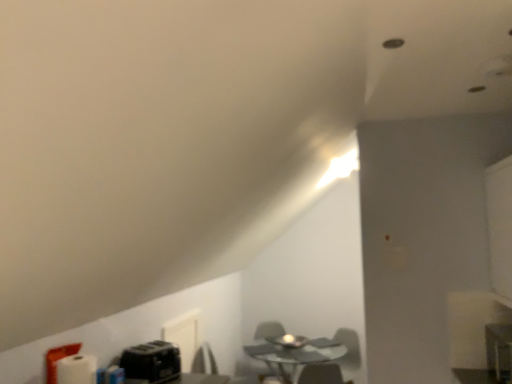
Question: Can you confirm if metallic silver computer desk at lower right is thinner than matte gray swivel chair at center?

Choices:
 (A) yes
 (B) no

Answer: (A)

Question: From the image's perspective, is metallic silver computer desk at lower right below matte gray swivel chair at center?

Choices:
 (A) no
 (B) yes

Answer: (A)

Question: Is metallic silver computer desk at lower right far from matte gray swivel chair at center?

Choices:
 (A) no
 (B) yes

Answer: (B)

Question: Is metallic silver computer desk at lower right in contact with matte gray swivel chair at center?

Choices:
 (A) yes
 (B) no

Answer: (B)

Question: Is the position of metallic silver computer desk at lower right more distant than that of matte gray swivel chair at center?

Choices:
 (A) yes
 (B) no

Answer: (B)

Question: Would you say matte gray swivel chair at center is inside or outside black plastic toaster at lower left?

Choices:
 (A) outside
 (B) inside

Answer: (A)

Question: Considering the positions of matte gray swivel chair at center and black plastic toaster at lower left in the image, is matte gray swivel chair at center bigger or smaller than black plastic toaster at lower left?

Choices:
 (A) big
 (B) small

Answer: (A)

Question: Looking at their shapes, would you say matte gray swivel chair at center is wider or thinner than black plastic toaster at lower left?

Choices:
 (A) wide
 (B) thin

Answer: (A)

Question: Visually, is matte gray swivel chair at center positioned to the left or to the right of black plastic toaster at lower left?

Choices:
 (A) right
 (B) left

Answer: (A)

Question: Choose the correct answer: Is transparent glass table at center inside metallic silver computer desk at lower right or outside it?

Choices:
 (A) outside
 (B) inside

Answer: (A)

Question: Is point (346, 352) positioned closer to the camera than point (507, 342)?

Choices:
 (A) farther
 (B) closer

Answer: (A)

Question: From a real-world perspective, is transparent glass table at center positioned above or below metallic silver computer desk at lower right?

Choices:
 (A) below
 (B) above

Answer: (A)

Question: From the image's perspective, is transparent glass table at center above or below metallic silver computer desk at lower right?

Choices:
 (A) below
 (B) above

Answer: (A)

Question: Is transparent glass table at center in front of or behind black plastic toaster at lower left in the image?

Choices:
 (A) behind
 (B) front

Answer: (A)

Question: Is transparent glass table at center wider or thinner than black plastic toaster at lower left?

Choices:
 (A) wide
 (B) thin

Answer: (A)